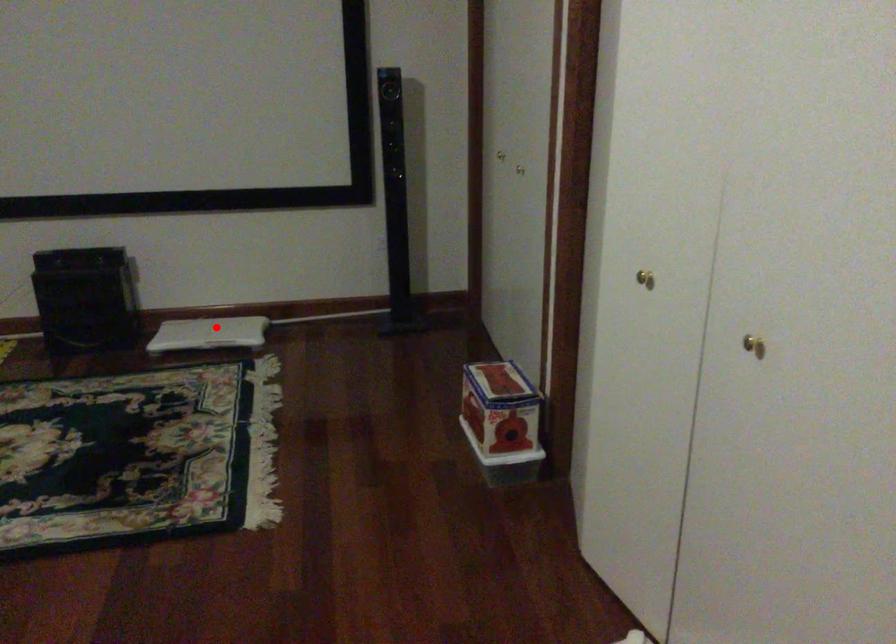
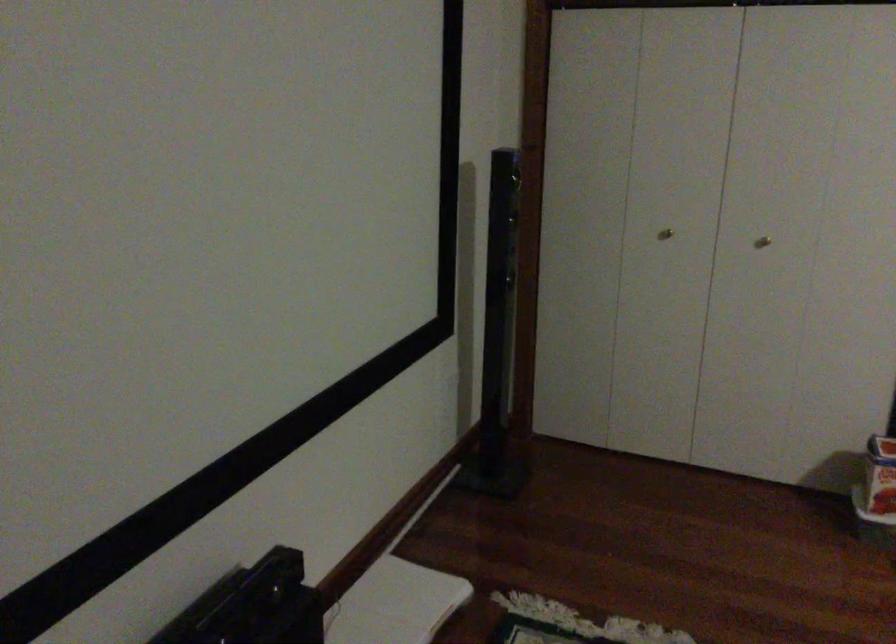
Question: A red point is marked in image1. In image2, is the corresponding 3D point closer to the camera or farther? Reply with the corresponding letter.

Choices:
 (A) The corresponding 3D point is closer.
 (B) The corresponding 3D point is farther.

Answer: (A)